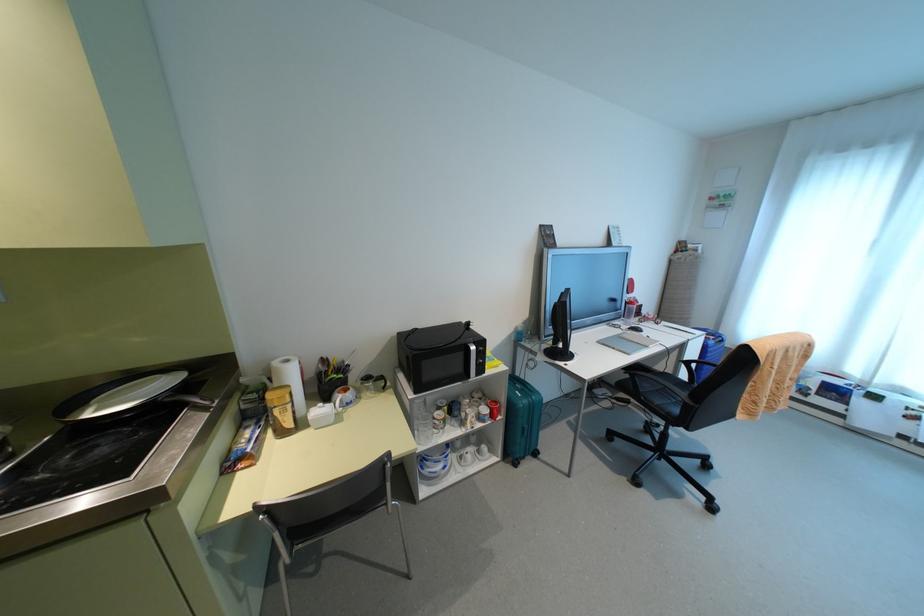
This screenshot has height=616, width=924. In order to click on microwave door handle in this screenshot , I will do `click(475, 358)`.